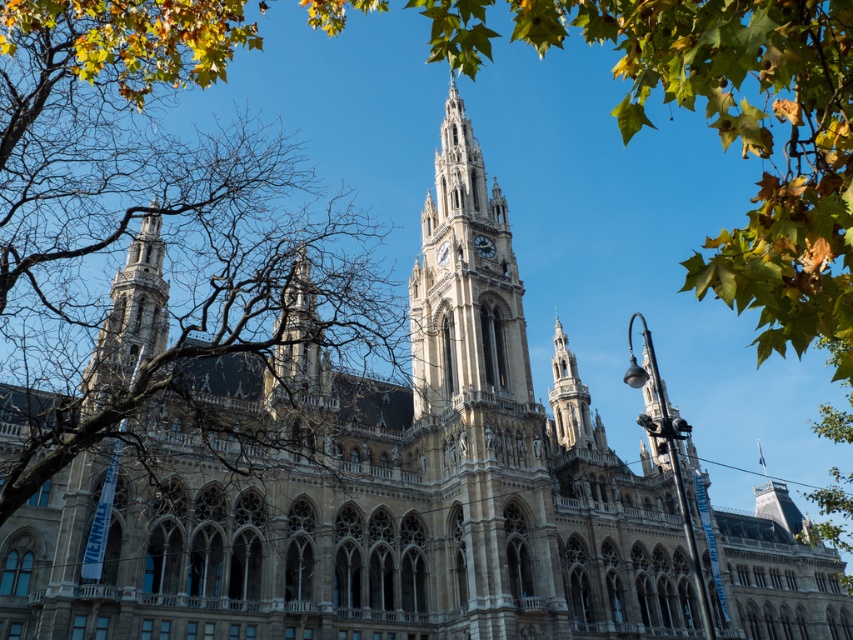
Question: Which point appears closest to the camera in this image?

Choices:
 (A) (410, 358)
 (B) (490, 243)
 (C) (572, 355)
 (D) (154, 300)

Answer: (D)

Question: Can you confirm if stone tower at left is positioned above silver metallic clock at center?

Choices:
 (A) no
 (B) yes

Answer: (A)

Question: Which point is closer to the camera?

Choices:
 (A) (160, 225)
 (B) (497, 284)
 (C) (473, 243)

Answer: (A)

Question: Can you confirm if stone tower at left is positioned below silver metallic clock at center?

Choices:
 (A) yes
 (B) no

Answer: (A)

Question: Is golden stone tower at center bigger than silver metallic clock at center?

Choices:
 (A) no
 (B) yes

Answer: (B)

Question: Which point is closer to the camera taking this photo?

Choices:
 (A) (482, 241)
 (B) (120, 362)
 (C) (433, 205)

Answer: (B)